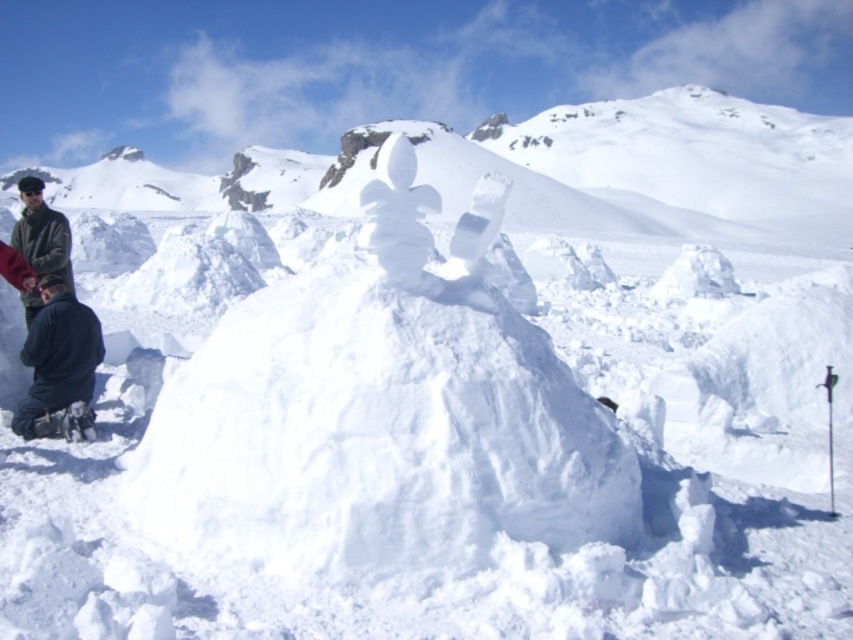
You are standing at the base of the snow sculpture and want to reach the point marked at coordinates point [28,410]. Given that the sculpture is 18 meters tall, can you safely walk around it to reach that point without climbing?

The distance between point [28,410] and the viewer is 19.32 meters. Since the snow sculpture is only 18 meters tall, you can safely walk around it to reach the point without needing to climb.

You are an explorer in the snowy landscape. You need to move from your current position to retrieve the dark blue fleece at lower left. However, there is a dark gray jacket at left in between you and the fleece. Can you reach the fleece without getting too close to the jacket?

The distance between the dark blue fleece at lower left and the dark gray jacket at left is 1.79 meters. Since the jacket is in between you and the fleece, you can safely move around it while maintaining a distance of at least 1.79 meters to avoid getting too close.

You are standing in the snowy landscape and want to place a small flag at the exact location of the dark blue fleece at lower left. What are the coordinates where you should place the flag?

The coordinates for the dark blue fleece at lower left are at point (57, 356), so you should place the flag there.